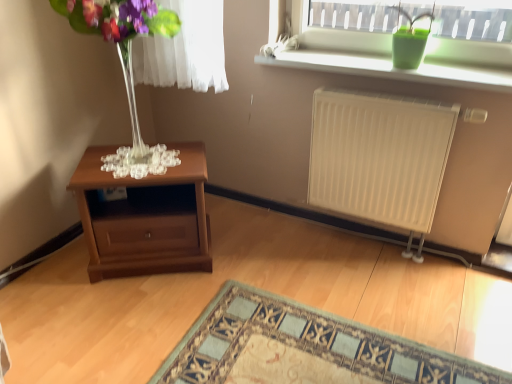
The image size is (512, 384). I want to click on vacant area situated below transparent glass vase at left (from a real-world perspective), so click(143, 159).